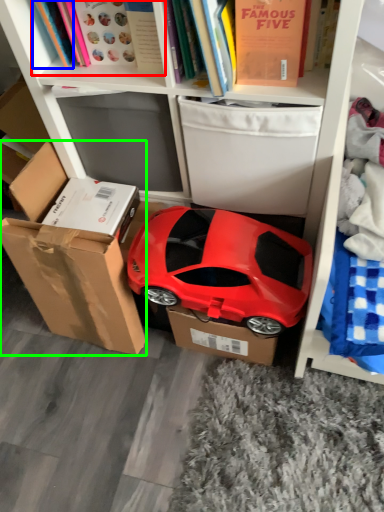
Question: Estimate the real-world distances between objects in this image. Which object is farther from book (highlighted by a red box), book (highlighted by a blue box) or box (highlighted by a green box)?

Choices:
 (A) book
 (B) box

Answer: (B)